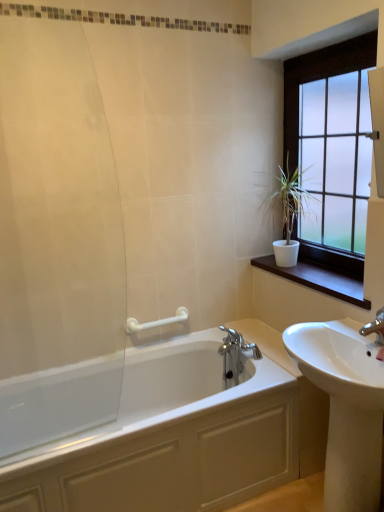
The height and width of the screenshot is (512, 384). I want to click on vacant area on top of white wood at right (from a real-world perspective), so click(320, 276).